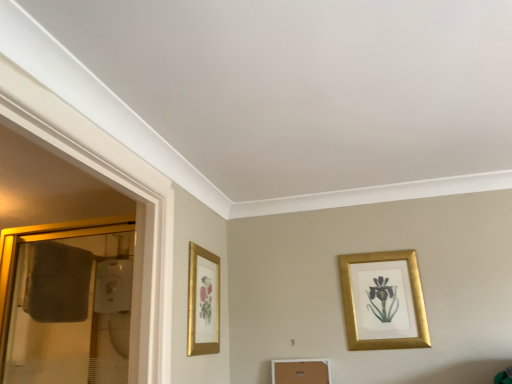
This screenshot has height=384, width=512. I want to click on gold metallic picture frame at upper right, which appears as the 2th picture frame when viewed from the left, so click(383, 301).

The image size is (512, 384). Describe the element at coordinates (383, 301) in the screenshot. I see `gold metallic picture frame at upper right, which appears as the 2th picture frame when viewed from the left` at that location.

What is the approximate height of gold framed picture at left, the second picture frame when ordered from right to left?

It is 41.79 centimeters.

This screenshot has height=384, width=512. Identify the location of gold metallic picture frame at upper right, which appears as the 2th picture frame when viewed from the left. (383, 301).

Is gold framed picture at left, the second picture frame when ordered from right to left, facing away from gold-framed mirror at left?

Yes, gold framed picture at left, the second picture frame when ordered from right to left, is positioned with its back facing gold-framed mirror at left.

Between gold framed picture at left, the second picture frame when ordered from right to left, and gold-framed mirror at left, which one has more height?

gold-framed mirror at left is taller.

Which object is positioned more to the left, gold framed picture at left, the second picture frame when ordered from right to left, or gold-framed mirror at left?

gold-framed mirror at left.

Is gold framed picture at left, the second picture frame when ordered from right to left, at the right side of gold metallic picture frame at upper right, placed as the 1th picture frame when sorted from right to left?

No.

The image size is (512, 384). Find the location of `picture frame that is above the gold metallic picture frame at upper right, placed as the 1th picture frame when sorted from right to left (from a real-world perspective)`. picture frame that is above the gold metallic picture frame at upper right, placed as the 1th picture frame when sorted from right to left (from a real-world perspective) is located at coordinates (203, 302).

Between gold framed picture at left, the first picture frame viewed from the left, and gold metallic picture frame at upper right, placed as the 1th picture frame when sorted from right to left, which one has less height?

gold framed picture at left, the first picture frame viewed from the left, is shorter.

Relative to gold metallic picture frame at upper right, placed as the 1th picture frame when sorted from right to left, is gold framed picture at left, the first picture frame viewed from the left, in front or behind?

gold framed picture at left, the first picture frame viewed from the left, is positioned closer to the viewer than gold metallic picture frame at upper right, placed as the 1th picture frame when sorted from right to left.

Are gold-framed mirror at left and gold framed picture at left, the first picture frame viewed from the left, far apart?

That's not correct — gold-framed mirror at left is a little close to gold framed picture at left, the first picture frame viewed from the left.

Between point (117, 299) and point (206, 305), which one is positioned behind?

The point (117, 299) is more distant.

Is point (393, 283) positioned behind point (193, 323)?

Yes, point (393, 283) is behind point (193, 323).

Considering the positions of objects gold metallic picture frame at upper right, which appears as the 2th picture frame when viewed from the left, and gold framed picture at left, the first picture frame viewed from the left, in the image provided, who is more to the right, gold metallic picture frame at upper right, which appears as the 2th picture frame when viewed from the left, or gold framed picture at left, the first picture frame viewed from the left,?

gold metallic picture frame at upper right, which appears as the 2th picture frame when viewed from the left.

From a real-world perspective, is gold metallic picture frame at upper right, which appears as the 2th picture frame when viewed from the left, over gold framed picture at left, the second picture frame when ordered from right to left?

No, from a real-world perspective, gold metallic picture frame at upper right, which appears as the 2th picture frame when viewed from the left, is not on top of gold framed picture at left, the second picture frame when ordered from right to left.

Looking at this image, is gold-framed mirror at left positioned far away from gold metallic picture frame at upper right, placed as the 1th picture frame when sorted from right to left?

Yes, gold-framed mirror at left is far from gold metallic picture frame at upper right, placed as the 1th picture frame when sorted from right to left.

Can you tell me how much gold-framed mirror at left and gold metallic picture frame at upper right, which appears as the 2th picture frame when viewed from the left, differ in facing direction?

0.402 degrees.

Who is smaller, gold-framed mirror at left or gold metallic picture frame at upper right, placed as the 1th picture frame when sorted from right to left?

gold metallic picture frame at upper right, placed as the 1th picture frame when sorted from right to left, is smaller.

Is gold metallic picture frame at upper right, placed as the 1th picture frame when sorted from right to left, facing away from gold-framed mirror at left?

No, gold metallic picture frame at upper right, placed as the 1th picture frame when sorted from right to left, is not facing away from gold-framed mirror at left.

Based on the photo, between gold metallic picture frame at upper right, which appears as the 2th picture frame when viewed from the left, and gold-framed mirror at left, which one appears on the left side from the viewer's perspective?

From the viewer's perspective, gold-framed mirror at left appears more on the left side.

Between gold metallic picture frame at upper right, which appears as the 2th picture frame when viewed from the left, and gold-framed mirror at left, which one has larger size?

gold-framed mirror at left is bigger.

Who is taller, gold metallic picture frame at upper right, which appears as the 2th picture frame when viewed from the left, or gold-framed mirror at left?

With more height is gold-framed mirror at left.

This screenshot has height=384, width=512. I want to click on glass door above the gold framed picture at left, the first picture frame viewed from the left (from a real-world perspective), so click(66, 301).

Find the location of a particular element. The width and height of the screenshot is (512, 384). picture frame below the gold framed picture at left, the second picture frame when ordered from right to left (from a real-world perspective) is located at coordinates (383, 301).

Looking at the image, which one is located closer to gold framed picture at left, the second picture frame when ordered from right to left, gold metallic picture frame at upper right, placed as the 1th picture frame when sorted from right to left, or gold-framed mirror at left?

gold metallic picture frame at upper right, placed as the 1th picture frame when sorted from right to left, is closer to gold framed picture at left, the second picture frame when ordered from right to left.

Looking at the image, which one is located further to gold metallic picture frame at upper right, which appears as the 2th picture frame when viewed from the left, gold-framed mirror at left or gold framed picture at left, the first picture frame viewed from the left?

The object further to gold metallic picture frame at upper right, which appears as the 2th picture frame when viewed from the left, is gold-framed mirror at left.

From the image, which object appears to be farther from gold metallic picture frame at upper right, placed as the 1th picture frame when sorted from right to left, gold framed picture at left, the first picture frame viewed from the left, or gold-framed mirror at left?

Among the two, gold-framed mirror at left is located further to gold metallic picture frame at upper right, placed as the 1th picture frame when sorted from right to left.

Based on the photo, looking at the image, which one is located further to gold-framed mirror at left, gold metallic picture frame at upper right, which appears as the 2th picture frame when viewed from the left, or gold framed picture at left, the second picture frame when ordered from right to left?

gold metallic picture frame at upper right, which appears as the 2th picture frame when viewed from the left, is further to gold-framed mirror at left.

Considering their positions, is gold framed picture at left, the first picture frame viewed from the left, positioned closer to gold-framed mirror at left than gold metallic picture frame at upper right, placed as the 1th picture frame when sorted from right to left?

The object closer to gold-framed mirror at left is gold framed picture at left, the first picture frame viewed from the left.

Estimate the real-world distances between objects in this image. Which object is further from gold framed picture at left, the first picture frame viewed from the left, gold-framed mirror at left or gold metallic picture frame at upper right, which appears as the 2th picture frame when viewed from the left?

The object further to gold framed picture at left, the first picture frame viewed from the left, is gold-framed mirror at left.

At what (x,y) coordinates should I click in order to perform the action: click on picture frame situated between gold-framed mirror at left and gold metallic picture frame at upper right, placed as the 1th picture frame when sorted from right to left, from left to right. Please return your answer as a coordinate pair (x, y). The height and width of the screenshot is (384, 512). Looking at the image, I should click on (203, 302).